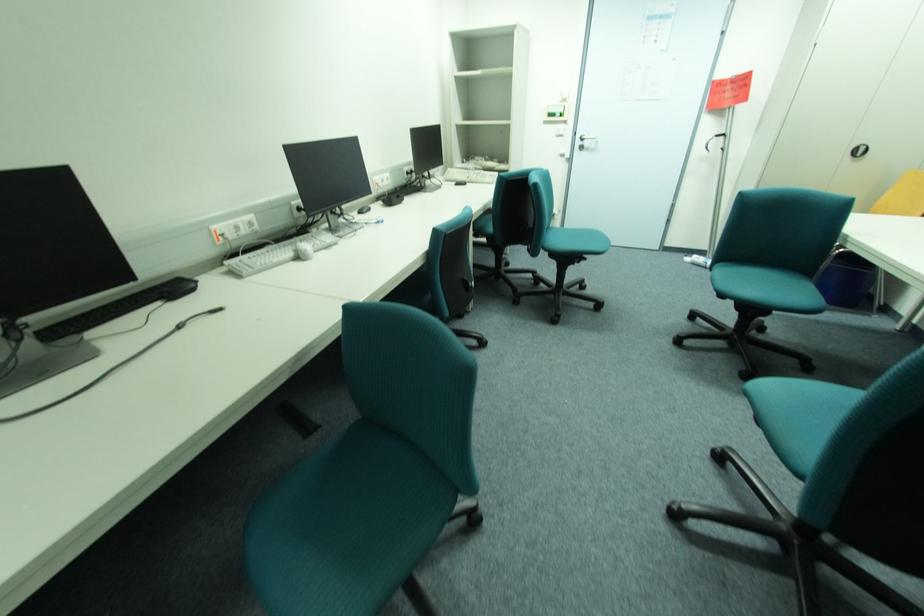
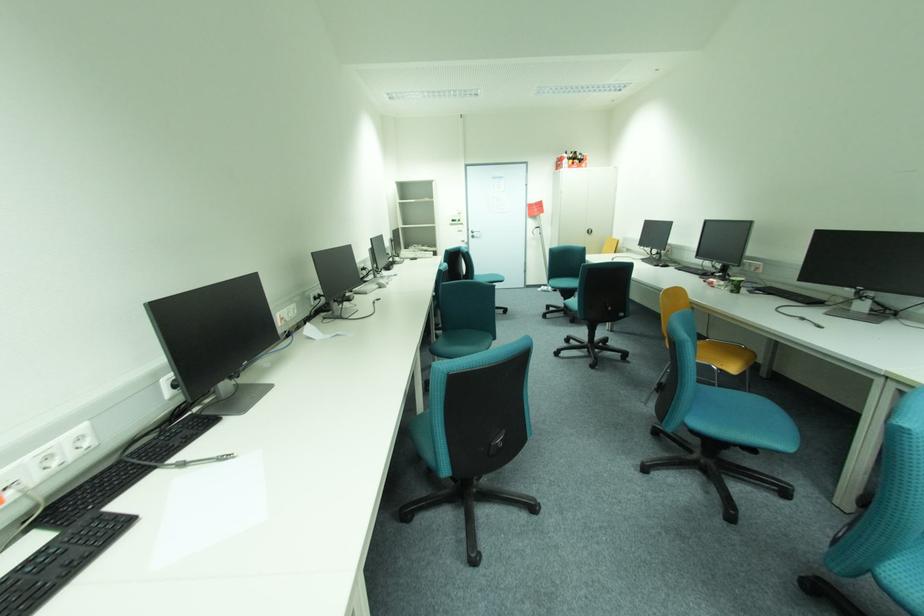
Which direction would the cameraman need to move to produce the second image?

The movement direction of the cameraman is left, backward.